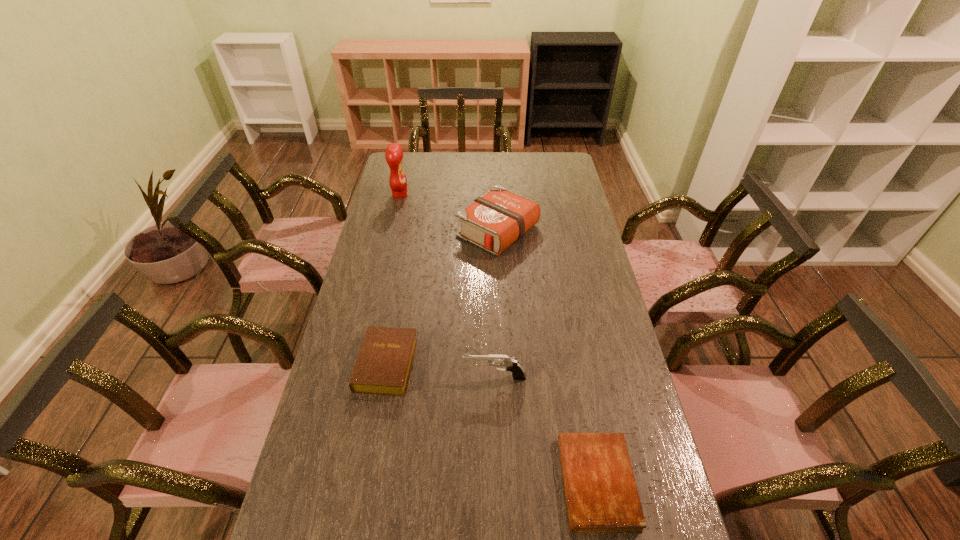
I want to click on the farthest object, so click(394, 154).

The height and width of the screenshot is (540, 960). In order to click on condiment in this screenshot , I will do `click(394, 154)`.

This screenshot has width=960, height=540. What are the coordinates of `the farthest Bible` in the screenshot? It's located at (x=494, y=221).

Locate an element on the screen. This screenshot has height=540, width=960. the tallest Bible is located at coordinates (494, 221).

Image resolution: width=960 pixels, height=540 pixels. What are the coordinates of `gun` in the screenshot? It's located at (511, 364).

Locate an element on the screen. The image size is (960, 540). the second farthest Bible is located at coordinates (383, 366).

What are the coordinates of `the second shortest object` in the screenshot? It's located at (383, 366).

What are the coordinates of `the nearest object` in the screenshot? It's located at (601, 493).

The width and height of the screenshot is (960, 540). In order to click on the shortest Bible in this screenshot , I will do `click(601, 493)`.

This screenshot has width=960, height=540. I want to click on free space located on the label side of the condiment, so 481,195.